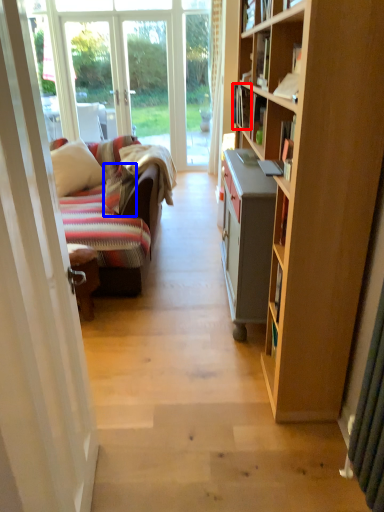
Question: Which object appears closest to the camera in this image, book (highlighted by a red box) or pillow (highlighted by a blue box)?

Choices:
 (A) book
 (B) pillow

Answer: (A)